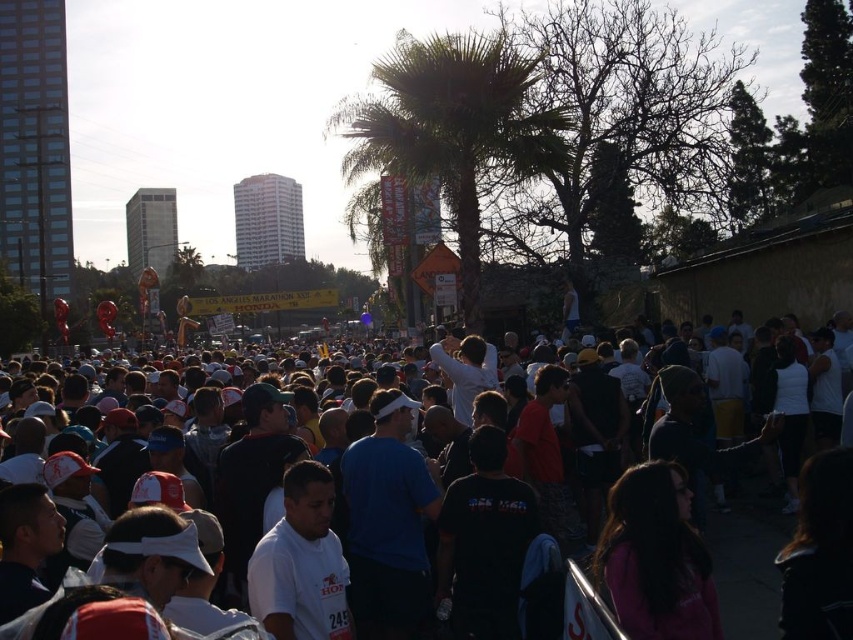
Question: Among these points, which one is nearest to the camera?

Choices:
 (A) (502, 147)
 (B) (747, 480)

Answer: (B)

Question: Does green leafy palm tree at center have a greater width compared to white cotton crowd at center?

Choices:
 (A) yes
 (B) no

Answer: (B)

Question: In this image, where is green leafy palm tree at center located relative to white cotton crowd at center?

Choices:
 (A) below
 (B) above

Answer: (B)

Question: Observing the image, what is the correct spatial positioning of green leafy palm tree at center in reference to white cotton crowd at center?

Choices:
 (A) right
 (B) left

Answer: (B)

Question: Among these points, which one is nearest to the camera?

Choices:
 (A) (755, 577)
 (B) (467, 282)

Answer: (A)

Question: Which point is closer to the camera?

Choices:
 (A) green leafy palm tree at center
 (B) white cotton crowd at center

Answer: (B)